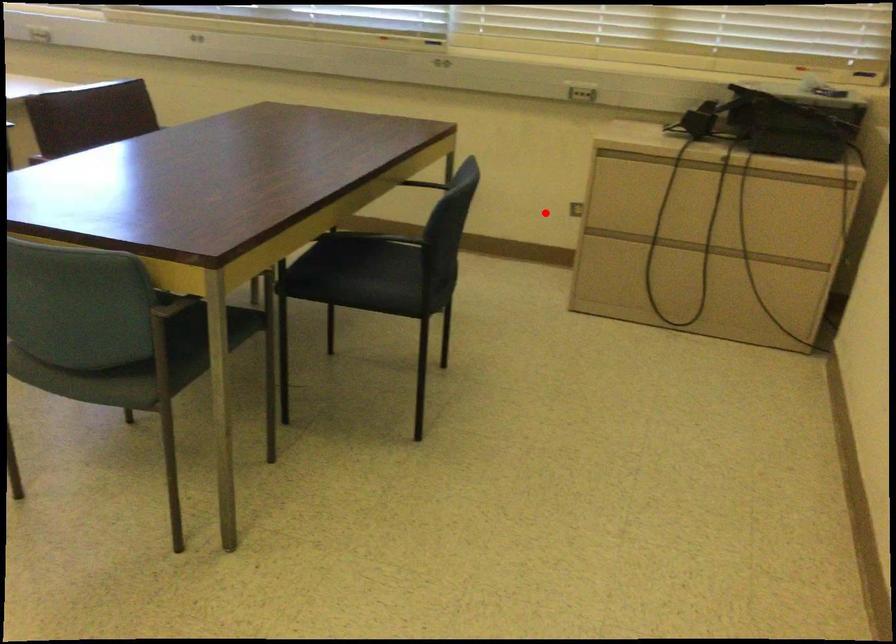
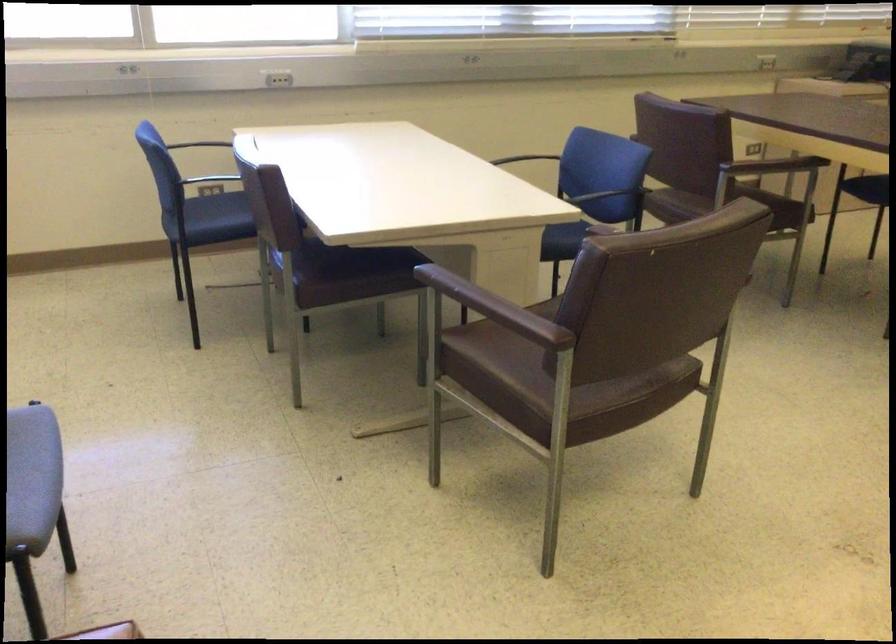
Question: I am providing you with two images of the same scene from different viewpoints. Given a red point in image1, look at the same physical point in image2. Is it:

Choices:
 (A) Closer to the viewpoint
 (B) Farther from the viewpoint

Answer: (B)